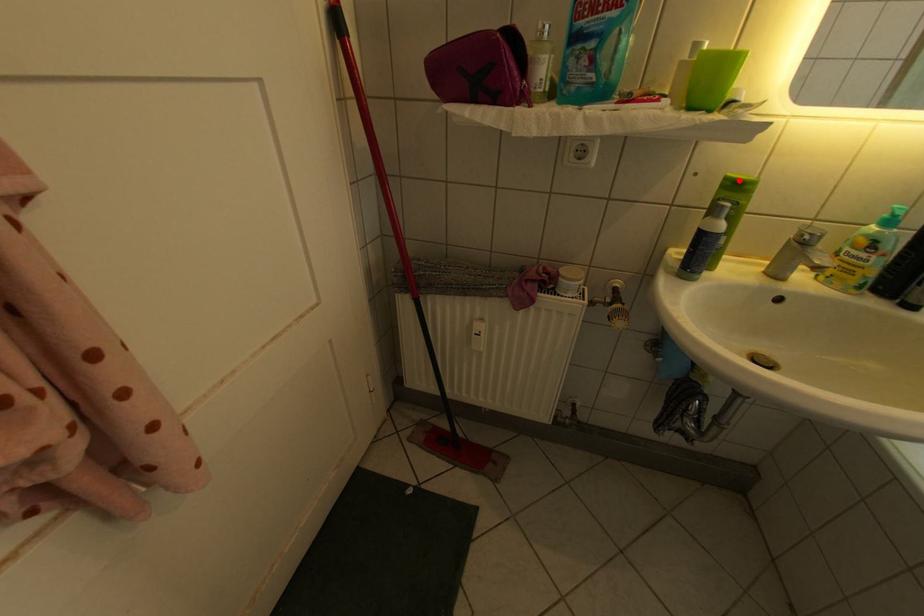
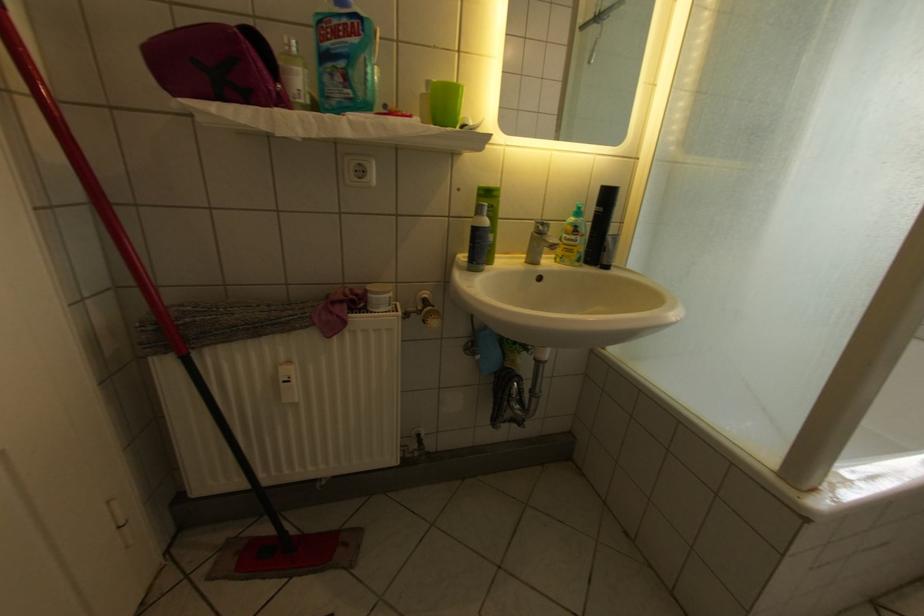
In the second image, find the point that corresponds to the highlighted location in the first image.

(492, 191)